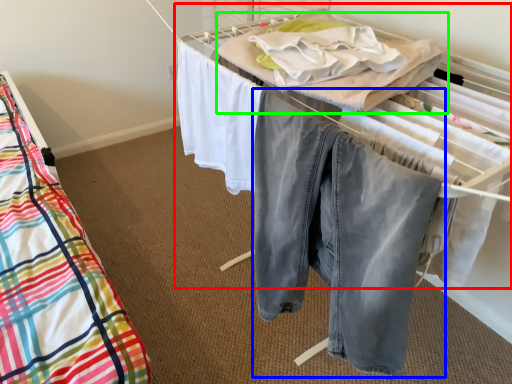
Question: Based on their relative distances, which object is nearer to bed (highlighted by a red box)? Choose from trousers (highlighted by a blue box) and blanket (highlighted by a green box).

Choices:
 (A) trousers
 (B) blanket

Answer: (B)